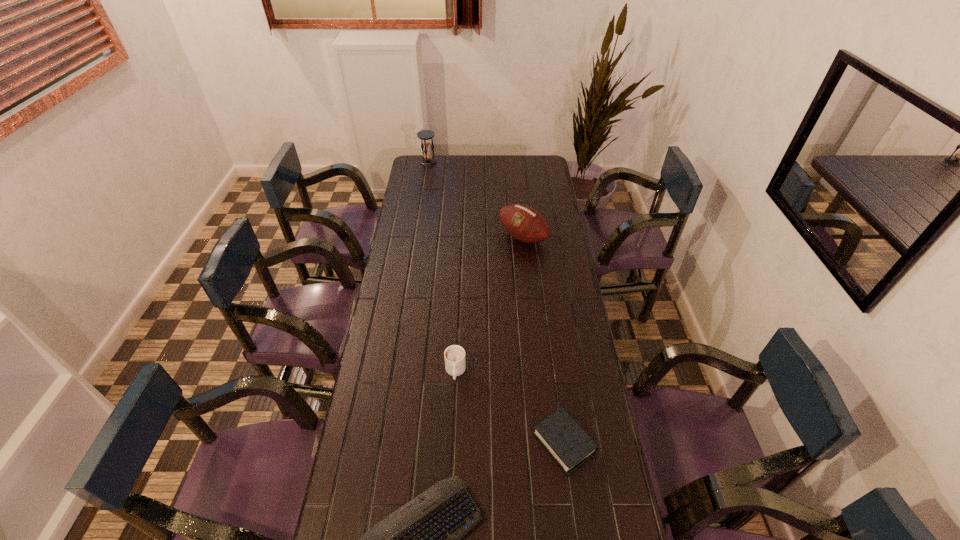
Identify the location of vacant space that's between the farthest object and the Bible. The width and height of the screenshot is (960, 540). (496, 302).

Where is `vacant area that lies between the cappuccino and the farthest object`? Image resolution: width=960 pixels, height=540 pixels. vacant area that lies between the cappuccino and the farthest object is located at coordinates (442, 267).

Find the location of a particular element. The height and width of the screenshot is (540, 960). vacant space in between the football (American) and the hourglass is located at coordinates (475, 199).

Locate an element on the screen. Image resolution: width=960 pixels, height=540 pixels. object that stands as the second closest to the farthest object is located at coordinates [x=454, y=355].

Select which object appears as the fourth closest to the computer keyboard. Please provide its 2D coordinates. Your answer should be formatted as a tuple, i.e. [(x, y)], where the tuple contains the x and y coordinates of a point satisfying the conditions above.

[(425, 135)]

Where is `free region that satisfies the following two spatial constraints: 1. on the front side of the hourglass; 2. on the left side of the second shortest object`? Image resolution: width=960 pixels, height=540 pixels. free region that satisfies the following two spatial constraints: 1. on the front side of the hourglass; 2. on the left side of the second shortest object is located at coordinates (384, 443).

Locate an element on the screen. This screenshot has width=960, height=540. blank area in the image that satisfies the following two spatial constraints: 1. on the side with the handle of the Bible; 2. on the left side of the third tallest object is located at coordinates (452, 443).